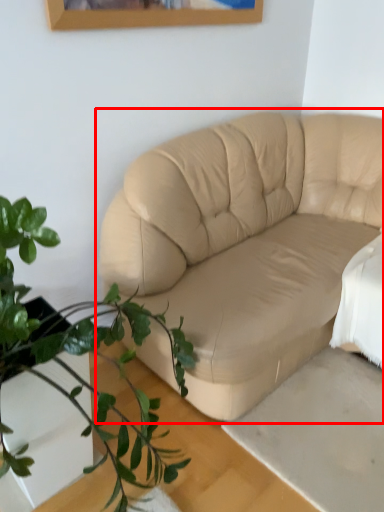
Question: Considering the relative positions of studio couch (annotated by the red box) and houseplant in the image provided, where is studio couch (annotated by the red box) located with respect to the staircase?

Choices:
 (A) left
 (B) right

Answer: (B)